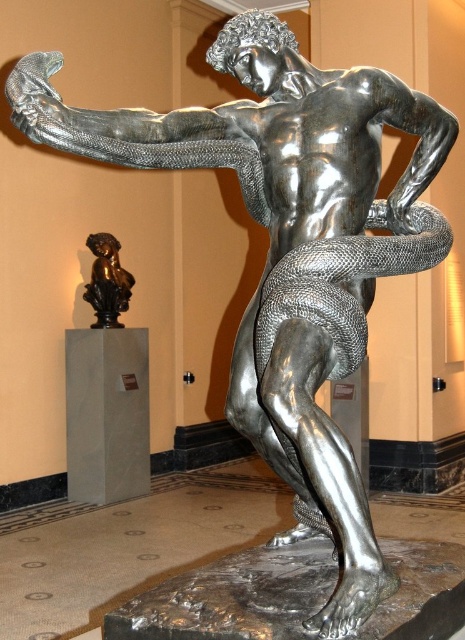
From the picture: Is white marble pillar at lower left closer to the viewer compared to bronze/bronze patina cherub at lower left?

Yes, white marble pillar at lower left is in front of bronze/bronze patina cherub at lower left.

Is white marble pillar at lower left thinner than bronze/bronze patina cherub at lower left?

No.

Which is behind, point (147, 369) or point (103, 257)?

The point (147, 369) is behind.

This screenshot has height=640, width=465. Identify the location of white marble pillar at lower left. (106, 413).